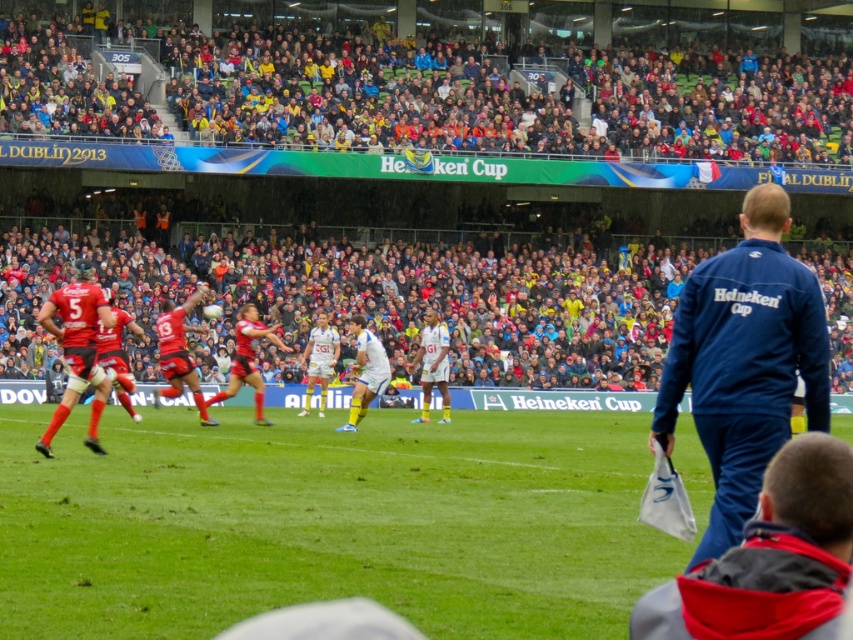
Question: Where is blue fabric jacket at lower right located in relation to red jersey at center in the image?

Choices:
 (A) below
 (B) above

Answer: (A)

Question: Which object appears farthest from the camera in this image?

Choices:
 (A) blue fabric jacket at lower right
 (B) blue fabric jacket at right

Answer: (B)

Question: Among these points, which one is nearest to the camera?

Choices:
 (A) (508, 84)
 (B) (830, 600)
 (C) (115, 323)

Answer: (B)

Question: Does multicolored fabric seats at upper center have a larger size compared to red jersey at center?

Choices:
 (A) yes
 (B) no

Answer: (A)

Question: Estimate the real-world distances between objects in this image. Which object is farther from the blue fabric jacket at lower right?

Choices:
 (A) blue fabric jacket at right
 (B) red jersey at center

Answer: (B)

Question: Is multicolored fabric seats at upper center to the right of red jersey at center from the viewer's perspective?

Choices:
 (A) no
 (B) yes

Answer: (B)